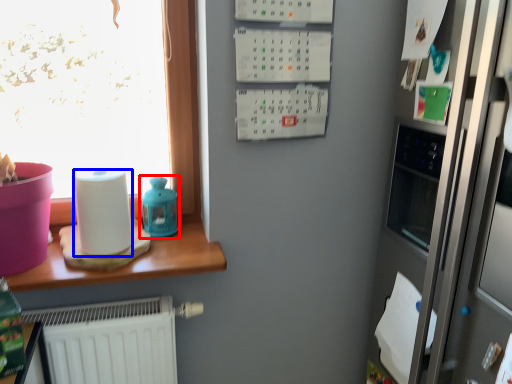
Question: Which object is closer to the camera taking this photo, appliance (highlighted by a red box) or paper towel (highlighted by a blue box)?

Choices:
 (A) appliance
 (B) paper towel

Answer: (B)